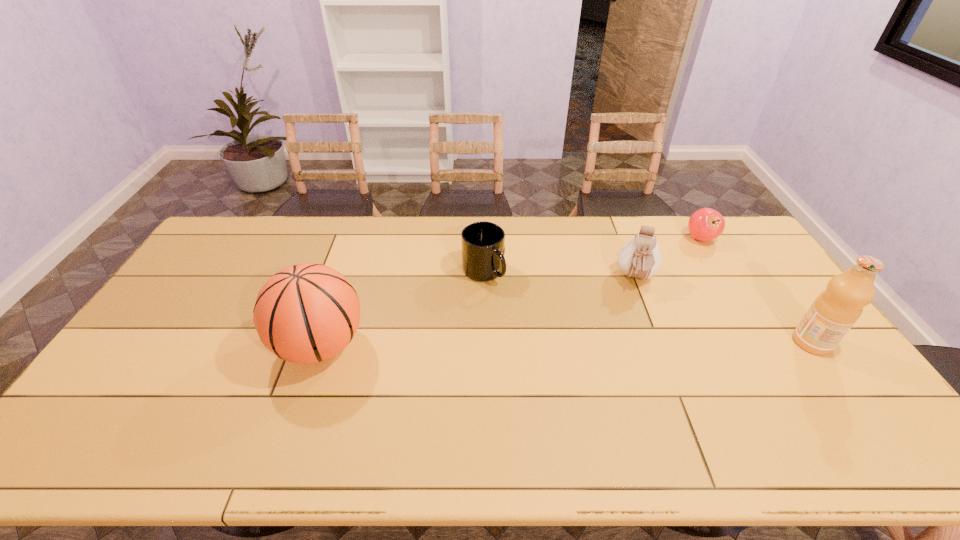
Find the location of a particular element. This screenshot has width=960, height=540. apple at the right edge is located at coordinates (706, 224).

At what (x,y) coordinates should I click in order to perform the action: click on object located at the far right corner. Please return your answer as a coordinate pair (x, y). Looking at the image, I should click on (706, 224).

In the image, there is a desktop. What are the coordinates of `free region at the far edge` in the screenshot? It's located at (562, 221).

This screenshot has height=540, width=960. In the image, there is a desktop. In order to click on free region at the near edge in this screenshot , I will do `click(716, 420)`.

Where is `vacant space at the far left corner`? vacant space at the far left corner is located at coordinates (240, 230).

I want to click on vacant space at the far right corner of the desktop, so click(754, 251).

The image size is (960, 540). I want to click on vacant area between the farthest object and the fourth object from right to left, so click(x=592, y=255).

Image resolution: width=960 pixels, height=540 pixels. I want to click on free space between the fruit juice and the shortest object, so click(x=756, y=290).

Find the location of a particular element. The image size is (960, 540). vacant area that lies between the second object from left to right and the leftmost object is located at coordinates (402, 308).

The image size is (960, 540). What are the coordinates of `free space that is in between the second shortest object and the pouch` in the screenshot? It's located at (560, 274).